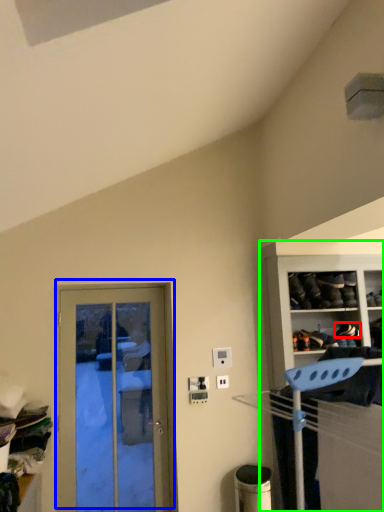
Question: Based on their relative distances, which object is nearer to shoe (highlighted by a red box)? Choose from door (highlighted by a blue box) and cabinetry (highlighted by a green box).

Choices:
 (A) door
 (B) cabinetry

Answer: (B)